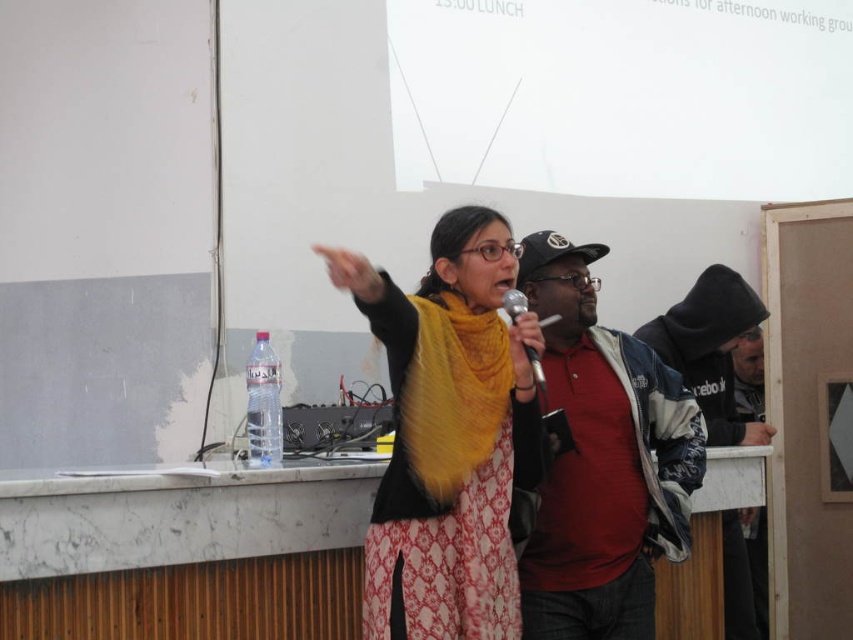
Which is above, dark blue hoodie at right or metallic silver microphone at center?

Positioned higher is metallic silver microphone at center.

This screenshot has width=853, height=640. I want to click on dark blue hoodie at right, so click(711, 349).

Is matte black jacket at center closer to camera compared to dark blue hoodie at right?

Yes, it is.

This screenshot has width=853, height=640. What do you see at coordinates (602, 461) in the screenshot?
I see `matte black jacket at center` at bounding box center [602, 461].

Is point (549, 371) farther from viewer compared to point (755, 326)?

That is False.

The height and width of the screenshot is (640, 853). I want to click on matte black jacket at center, so click(602, 461).

Based on the photo, does yellow wool scarf at center appear under dark blue hoodie at right?

Yes.

Does yellow wool scarf at center have a larger size compared to dark blue hoodie at right?

Indeed, yellow wool scarf at center has a larger size compared to dark blue hoodie at right.

Find the location of a particular element. yellow wool scarf at center is located at coordinates (448, 435).

This screenshot has height=640, width=853. Identify the location of yellow wool scarf at center. (448, 435).